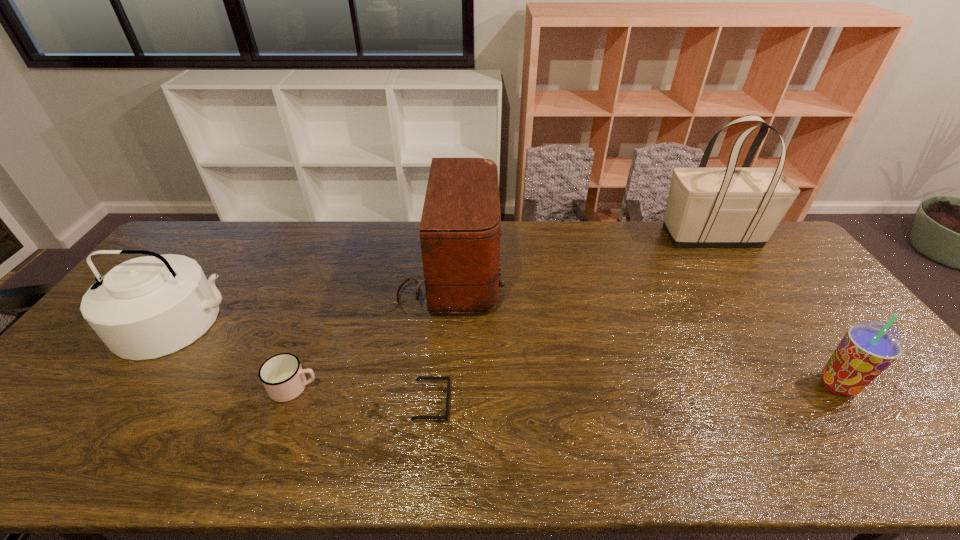
Locate an element on the screen. This screenshot has width=960, height=540. object that is at the far right corner is located at coordinates (730, 206).

At what (x,y) coordinates should I click in order to perform the action: click on free space at the far edge of the desktop. Please return your answer as a coordinate pair (x, y). The height and width of the screenshot is (540, 960). Looking at the image, I should click on (681, 255).

Where is `vacant space at the near edge of the desktop`? This screenshot has width=960, height=540. vacant space at the near edge of the desktop is located at coordinates (889, 460).

What are the coordinates of `blank space at the right edge of the desktop` in the screenshot? It's located at (805, 269).

Where is `free location at the far left corner`? free location at the far left corner is located at coordinates (198, 233).

You are a GUI agent. You are given a task and a screenshot of the screen. Output one action in this format:
    pyautogui.click(x=<x>, y=<y>)
    Task: Click on the blank area at the near left corner
    Image resolution: width=960 pixels, height=540 pixels.
    Given the screenshot: What is the action you would take?
    pyautogui.click(x=70, y=436)

Where is `free space at the far right corner of the desktop`? free space at the far right corner of the desktop is located at coordinates (782, 251).

In the image, there is a desktop. At what (x,y) coordinates should I click in order to perform the action: click on free region at the near right corner. Please return your answer as a coordinate pair (x, y). Image resolution: width=960 pixels, height=540 pixels. Looking at the image, I should click on (950, 468).

Locate an element on the screen. The width and height of the screenshot is (960, 540). vacant space that is in between the mug and the radio receiver is located at coordinates (372, 331).

You are a GUI agent. You are given a task and a screenshot of the screen. Output one action in this format:
    pyautogui.click(x=<x>, y=<y>)
    Task: Click on the free space between the sunglasses and the fifth shortest object
    The width and height of the screenshot is (960, 540).
    Given the screenshot: What is the action you would take?
    pyautogui.click(x=440, y=339)